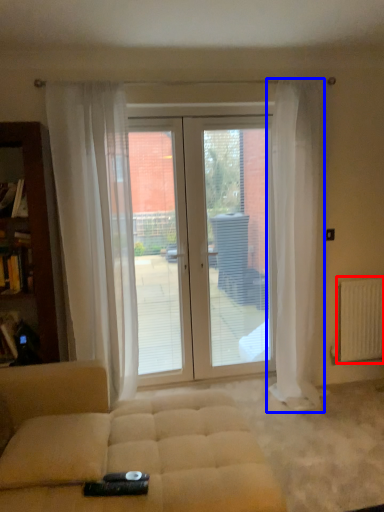
Question: Among these objects, which one is farthest to the camera, radiator (highlighted by a red box) or curtain (highlighted by a blue box)?

Choices:
 (A) radiator
 (B) curtain

Answer: (A)